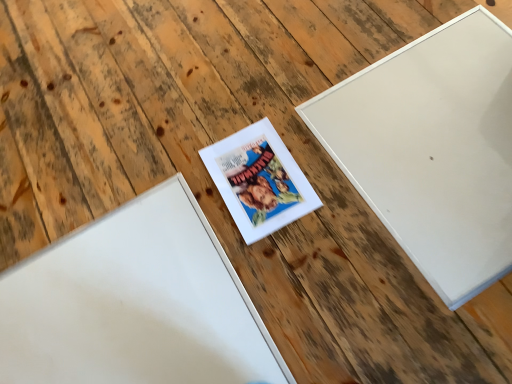
Describe the element at coordinates (259, 180) in the screenshot. I see `white matte picture frame at center, positioned as the 2th picture frame in right-to-left order` at that location.

What do you see at coordinates (433, 149) in the screenshot? The width and height of the screenshot is (512, 384). I see `white matte picture frame at upper right, arranged as the first picture frame when viewed from the right` at bounding box center [433, 149].

Locate an element on the screen. Image resolution: width=512 pixels, height=384 pixels. white matte picture frame at center, the 3th picture frame in the right-to-left sequence is located at coordinates (134, 304).

Does white matte picture frame at center, the 3th picture frame in the right-to-left sequence, have a lesser height compared to white matte picture frame at center, which is the second picture frame from left to right?

Yes.

Are white matte picture frame at center, positioned as the first picture frame in left-to-right order, and white matte picture frame at center, positioned as the 2th picture frame in right-to-left order, located far from each other?

No.

In the scene shown: Choose the correct answer: Is white matte picture frame at center, the 3th picture frame in the right-to-left sequence, inside white matte picture frame at center, positioned as the 2th picture frame in right-to-left order, or outside it?

white matte picture frame at center, the 3th picture frame in the right-to-left sequence, lies outside white matte picture frame at center, positioned as the 2th picture frame in right-to-left order.

Considering the relative positions of white matte picture frame at center, positioned as the first picture frame in left-to-right order, and white matte picture frame at upper right, arranged as the first picture frame when viewed from the right, in the image provided, is white matte picture frame at center, positioned as the first picture frame in left-to-right order, to the right of white matte picture frame at upper right, arranged as the first picture frame when viewed from the right, from the viewer's perspective?

In fact, white matte picture frame at center, positioned as the first picture frame in left-to-right order, is to the left of white matte picture frame at upper right, arranged as the first picture frame when viewed from the right.

In the scene shown: Which point is more forward, (82, 234) or (455, 56)?

The point (82, 234) is closer to the camera.

Who is shorter, white matte picture frame at center, the 3th picture frame in the right-to-left sequence, or white matte picture frame at upper right, which appears as the third picture frame when viewed from the left?

With less height is white matte picture frame at upper right, which appears as the third picture frame when viewed from the left.

Is white matte picture frame at center, the 3th picture frame in the right-to-left sequence, not inside white matte picture frame at upper right, which appears as the third picture frame when viewed from the left?

Yes, white matte picture frame at center, the 3th picture frame in the right-to-left sequence, is outside of white matte picture frame at upper right, which appears as the third picture frame when viewed from the left.

Is point (250, 177) positioned in front of point (84, 240)?

No, (250, 177) is further to viewer.

Could you tell me if white matte picture frame at center, positioned as the 2th picture frame in right-to-left order, is turned towards white matte picture frame at center, positioned as the first picture frame in left-to-right order?

No.

Identify the location of picture frame located underneath the white matte picture frame at center, positioned as the 2th picture frame in right-to-left order (from a real-world perspective). (134, 304).

From a real-world perspective, is white matte picture frame at upper right, which appears as the third picture frame when viewed from the left, on white matte picture frame at center, the 3th picture frame in the right-to-left sequence?

Yes, from a real-world perspective, white matte picture frame at upper right, which appears as the third picture frame when viewed from the left, is above white matte picture frame at center, the 3th picture frame in the right-to-left sequence.

Are white matte picture frame at upper right, arranged as the first picture frame when viewed from the right, and white matte picture frame at center, the 3th picture frame in the right-to-left sequence, far apart?

white matte picture frame at upper right, arranged as the first picture frame when viewed from the right, is actually quite close to white matte picture frame at center, the 3th picture frame in the right-to-left sequence.

Considering the relative sizes of white matte picture frame at upper right, which appears as the third picture frame when viewed from the left, and white matte picture frame at center, positioned as the first picture frame in left-to-right order, in the image provided, is white matte picture frame at upper right, which appears as the third picture frame when viewed from the left, thinner than white matte picture frame at center, positioned as the first picture frame in left-to-right order,?

Incorrect, the width of white matte picture frame at upper right, which appears as the third picture frame when viewed from the left, is not less than that of white matte picture frame at center, positioned as the first picture frame in left-to-right order.

Relative to white matte picture frame at center, positioned as the 2th picture frame in right-to-left order, is white matte picture frame at upper right, arranged as the first picture frame when viewed from the right, in front or behind?

In the image, white matte picture frame at upper right, arranged as the first picture frame when viewed from the right, appears in front of white matte picture frame at center, positioned as the 2th picture frame in right-to-left order.

Which is in front, point (403, 49) or point (264, 185)?

Point (264, 185)

How different are the orientations of white matte picture frame at upper right, which appears as the third picture frame when viewed from the left, and white matte picture frame at center, which is the second picture frame from left to right, in degrees?

There is a 2.42-degree angle between the facing directions of white matte picture frame at upper right, which appears as the third picture frame when viewed from the left, and white matte picture frame at center, which is the second picture frame from left to right.

Considering the relative sizes of white matte picture frame at upper right, arranged as the first picture frame when viewed from the right, and white matte picture frame at center, which is the second picture frame from left to right, in the image provided, is white matte picture frame at upper right, arranged as the first picture frame when viewed from the right, bigger than white matte picture frame at center, which is the second picture frame from left to right,?

Indeed, white matte picture frame at upper right, arranged as the first picture frame when viewed from the right, has a larger size compared to white matte picture frame at center, which is the second picture frame from left to right.

How distant is white matte picture frame at center, which is the second picture frame from left to right, from white matte picture frame at upper right, which appears as the third picture frame when viewed from the left?

white matte picture frame at center, which is the second picture frame from left to right, is 11.36 inches away from white matte picture frame at upper right, which appears as the third picture frame when viewed from the left.

Is white matte picture frame at center, positioned as the 2th picture frame in right-to-left order, positioned with its back to white matte picture frame at upper right, arranged as the first picture frame when viewed from the right?

No, white matte picture frame at upper right, arranged as the first picture frame when viewed from the right, is not at the back of white matte picture frame at center, positioned as the 2th picture frame in right-to-left order.

Is white matte picture frame at center, positioned as the 2th picture frame in right-to-left order, taller than white matte picture frame at upper right, which appears as the third picture frame when viewed from the left?

Correct, white matte picture frame at center, positioned as the 2th picture frame in right-to-left order, is much taller as white matte picture frame at upper right, which appears as the third picture frame when viewed from the left.

From the image's perspective, between white matte picture frame at center, which is the second picture frame from left to right, and white matte picture frame at upper right, which appears as the third picture frame when viewed from the left, who is located below?

white matte picture frame at center, which is the second picture frame from left to right, appears lower in the image.

Locate an element on the screen. picture frame to the left of white matte picture frame at center, which is the second picture frame from left to right is located at coordinates (134, 304).

Find the location of `the 2nd picture frame above the white matte picture frame at center, positioned as the first picture frame in left-to-right order (from a real-world perspective)`. the 2nd picture frame above the white matte picture frame at center, positioned as the first picture frame in left-to-right order (from a real-world perspective) is located at coordinates (433, 149).

When comparing their distances from white matte picture frame at center, the 3th picture frame in the right-to-left sequence, does white matte picture frame at center, positioned as the 2th picture frame in right-to-left order, or white matte picture frame at upper right, arranged as the first picture frame when viewed from the right, seem further?

white matte picture frame at upper right, arranged as the first picture frame when viewed from the right, lies further to white matte picture frame at center, the 3th picture frame in the right-to-left sequence, than the other object.

Which object lies further to the anchor point white matte picture frame at center, positioned as the first picture frame in left-to-right order, white matte picture frame at upper right, arranged as the first picture frame when viewed from the right, or white matte picture frame at center, which is the second picture frame from left to right?

The object further to white matte picture frame at center, positioned as the first picture frame in left-to-right order, is white matte picture frame at upper right, arranged as the first picture frame when viewed from the right.

Considering their positions, is white matte picture frame at upper right, which appears as the third picture frame when viewed from the left, positioned further to white matte picture frame at center, which is the second picture frame from left to right, than white matte picture frame at center, the 3th picture frame in the right-to-left sequence?

white matte picture frame at upper right, which appears as the third picture frame when viewed from the left, is further to white matte picture frame at center, which is the second picture frame from left to right.

When comparing their distances from white matte picture frame at upper right, which appears as the third picture frame when viewed from the left, does white matte picture frame at center, the 3th picture frame in the right-to-left sequence, or white matte picture frame at center, positioned as the 2th picture frame in right-to-left order, seem further?

Based on the image, white matte picture frame at center, the 3th picture frame in the right-to-left sequence, appears to be further to white matte picture frame at upper right, which appears as the third picture frame when viewed from the left.

Considering their positions, is white matte picture frame at center, the 3th picture frame in the right-to-left sequence, positioned further to white matte picture frame at center, positioned as the 2th picture frame in right-to-left order, than white matte picture frame at upper right, arranged as the first picture frame when viewed from the right?

white matte picture frame at upper right, arranged as the first picture frame when viewed from the right, is further to white matte picture frame at center, positioned as the 2th picture frame in right-to-left order.

When comparing their distances from white matte picture frame at upper right, arranged as the first picture frame when viewed from the right, does white matte picture frame at center, which is the second picture frame from left to right, or white matte picture frame at center, positioned as the first picture frame in left-to-right order, seem closer?

white matte picture frame at center, which is the second picture frame from left to right, is positioned closer to the anchor white matte picture frame at upper right, arranged as the first picture frame when viewed from the right.

Where is `picture frame between white matte picture frame at center, positioned as the first picture frame in left-to-right order, and white matte picture frame at upper right, which appears as the third picture frame when viewed from the left, from left to right`? picture frame between white matte picture frame at center, positioned as the first picture frame in left-to-right order, and white matte picture frame at upper right, which appears as the third picture frame when viewed from the left, from left to right is located at coordinates (259, 180).